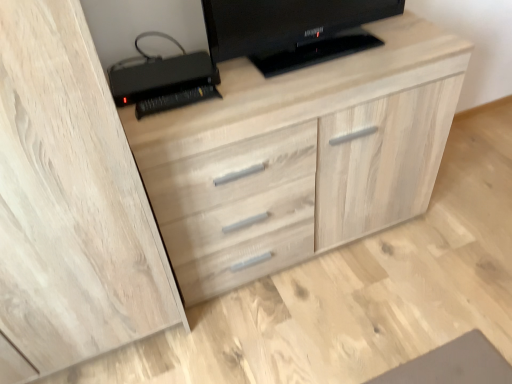
Question: Does light wood dresser at center appear on the left side of black plastic printer at upper left?

Choices:
 (A) yes
 (B) no

Answer: (B)

Question: Can you confirm if light wood dresser at center is taller than black plastic printer at upper left?

Choices:
 (A) yes
 (B) no

Answer: (A)

Question: Is there a large distance between light wood dresser at center and black plastic printer at upper left?

Choices:
 (A) yes
 (B) no

Answer: (B)

Question: Is light wood dresser at center wider than black plastic printer at upper left?

Choices:
 (A) no
 (B) yes

Answer: (B)

Question: Is light wood dresser at center in front of black plastic printer at upper left?

Choices:
 (A) yes
 (B) no

Answer: (A)

Question: Can you see light wood dresser at center touching black plastic printer at upper left?

Choices:
 (A) yes
 (B) no

Answer: (B)

Question: Does light wood dresser at center have a larger size compared to black glossy television at upper center?

Choices:
 (A) no
 (B) yes

Answer: (B)

Question: Is light wood dresser at center to the left of black glossy television at upper center from the viewer's perspective?

Choices:
 (A) yes
 (B) no

Answer: (A)

Question: Is light wood dresser at center to the right of black glossy television at upper center from the viewer's perspective?

Choices:
 (A) no
 (B) yes

Answer: (A)

Question: Can you confirm if light wood dresser at center is thinner than black glossy television at upper center?

Choices:
 (A) yes
 (B) no

Answer: (B)

Question: From a real-world perspective, is light wood dresser at center below black glossy television at upper center?

Choices:
 (A) yes
 (B) no

Answer: (A)

Question: Would you say light wood dresser at center contains black glossy television at upper center?

Choices:
 (A) yes
 (B) no

Answer: (B)

Question: Is black glossy television at upper center positioned before black plastic printer at upper left?

Choices:
 (A) no
 (B) yes

Answer: (B)